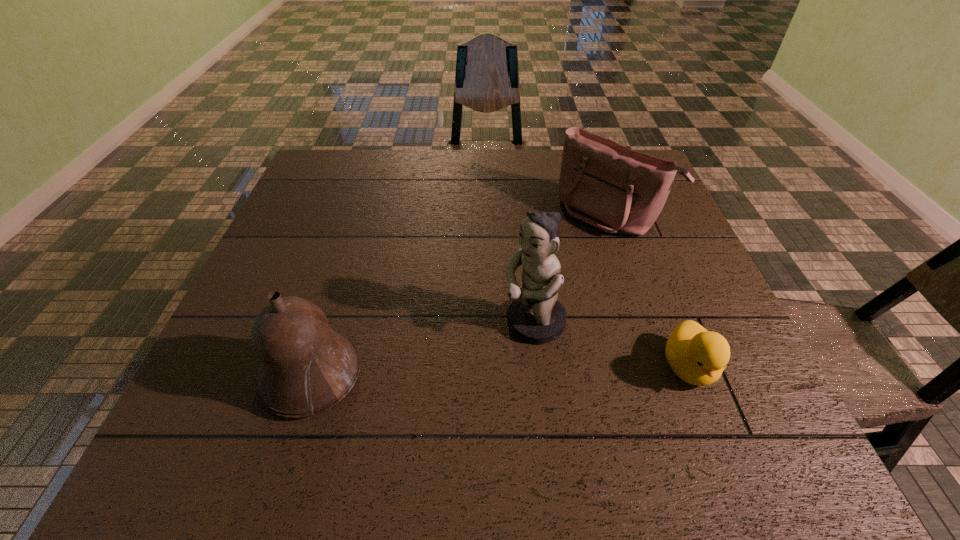
This screenshot has width=960, height=540. Find the location of `the leftmost object`. the leftmost object is located at coordinates (305, 368).

Where is `the shortest object`? The height and width of the screenshot is (540, 960). the shortest object is located at coordinates (697, 356).

The width and height of the screenshot is (960, 540). What are the coordinates of `shoulder bag` in the screenshot? It's located at (602, 183).

At what (x,y) coordinates should I click in order to perform the action: click on the tallest object. Please return your answer as a coordinate pair (x, y). The height and width of the screenshot is (540, 960). Looking at the image, I should click on (535, 316).

Find the location of a particular element. figurine is located at coordinates [535, 316].

This screenshot has width=960, height=540. Find the location of `free spot located 0.330m on the back of the leftmost object`. free spot located 0.330m on the back of the leftmost object is located at coordinates (356, 234).

This screenshot has height=540, width=960. What are the coordinates of `free space located on the front pocket of the farthest object` in the screenshot? It's located at (560, 259).

At what (x,y) coordinates should I click in order to perform the action: click on vacant space located 0.270m on the front pocket of the farthest object. Please return your answer as a coordinate pair (x, y). Looking at the image, I should click on (521, 296).

In order to click on free location located 0.320m on the front pocket of the farthest object in this screenshot , I will do `click(507, 309)`.

Where is `vacant space located 0.230m on the front-facing side of the tallest object`? The height and width of the screenshot is (540, 960). vacant space located 0.230m on the front-facing side of the tallest object is located at coordinates (410, 393).